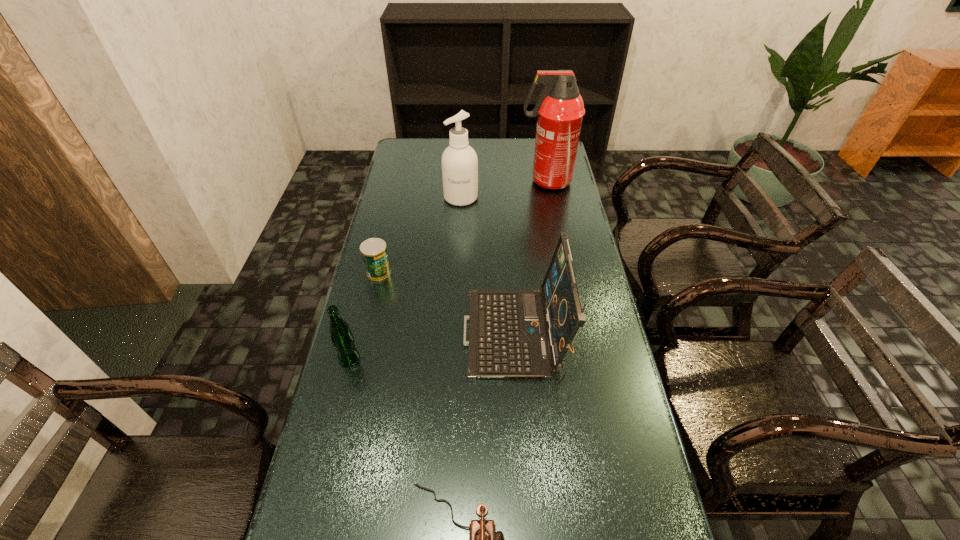
The image size is (960, 540). I want to click on fire extinguisher, so click(x=559, y=110).

This screenshot has width=960, height=540. I want to click on the fifth shortest object, so click(459, 161).

You are a GUI agent. You are given a task and a screenshot of the screen. Output one action in this format:
    pyautogui.click(x=<x>, y=<y>)
    Task: Click on the fourth shortest object
    
    Given the screenshot: What is the action you would take?
    pyautogui.click(x=512, y=334)

Identify the location of beer bottle. The width and height of the screenshot is (960, 540). (342, 338).

Find the location of a particular element. The height and width of the screenshot is (540, 960). the third farthest object is located at coordinates (374, 253).

The image size is (960, 540). Identify the location of can. tap(374, 253).

You are a GUI agent. You are given a task and a screenshot of the screen. Output one action in this format:
    pyautogui.click(x=<x>, y=<y>)
    Task: Click on the free space located on the trigger side of the tallest object
    The height and width of the screenshot is (540, 960).
    Given the screenshot: What is the action you would take?
    pos(478,181)

Where is `free space located 0.340m on the trigger side of the tallest object`? free space located 0.340m on the trigger side of the tallest object is located at coordinates (437, 181).

Identify the location of free space located 0.210m on the trigger side of the tallest object. (468, 181).

Find the location of a particular element. The width and height of the screenshot is (960, 540). vacant space positioned on the front label of the fifth shortest object is located at coordinates (457, 268).